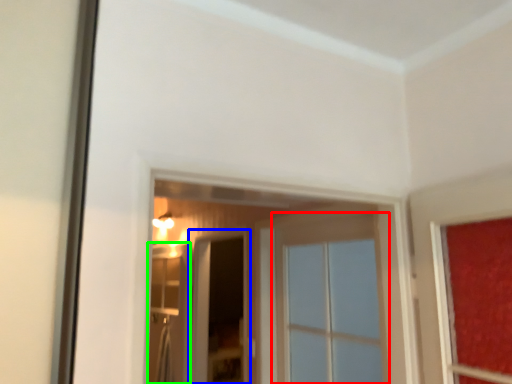
Question: Which is farther away from window (highlighted by a red box)? screen door (highlighted by a blue box) or screen door (highlighted by a green box)?

Choices:
 (A) screen door
 (B) screen door

Answer: (A)